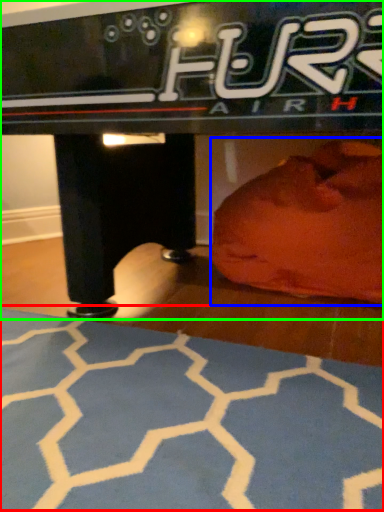
Question: Which object is positioned farthest from yoga mat (highlighted by a red box)? Select from bean bag chair (highlighted by a blue box) and table (highlighted by a green box).

Choices:
 (A) bean bag chair
 (B) table

Answer: (A)